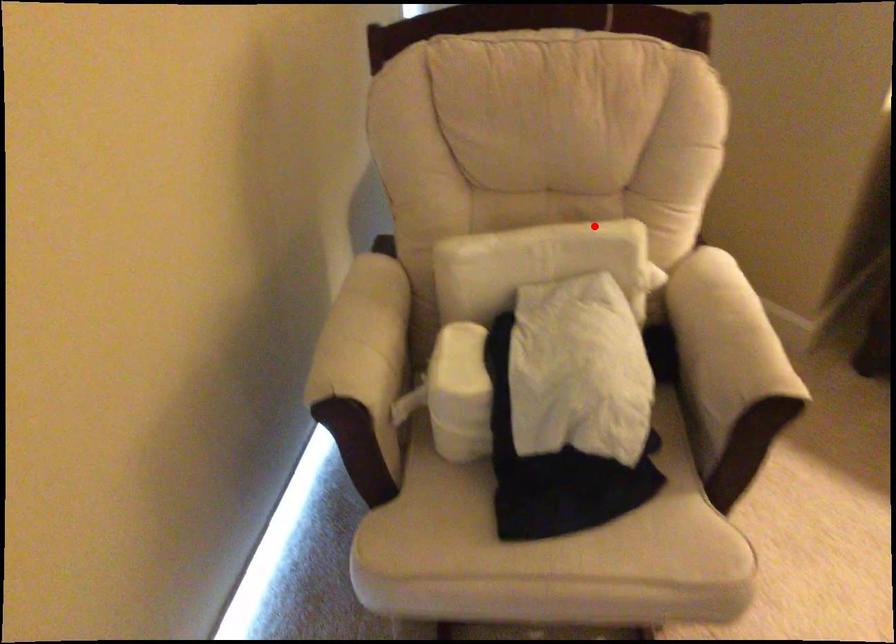
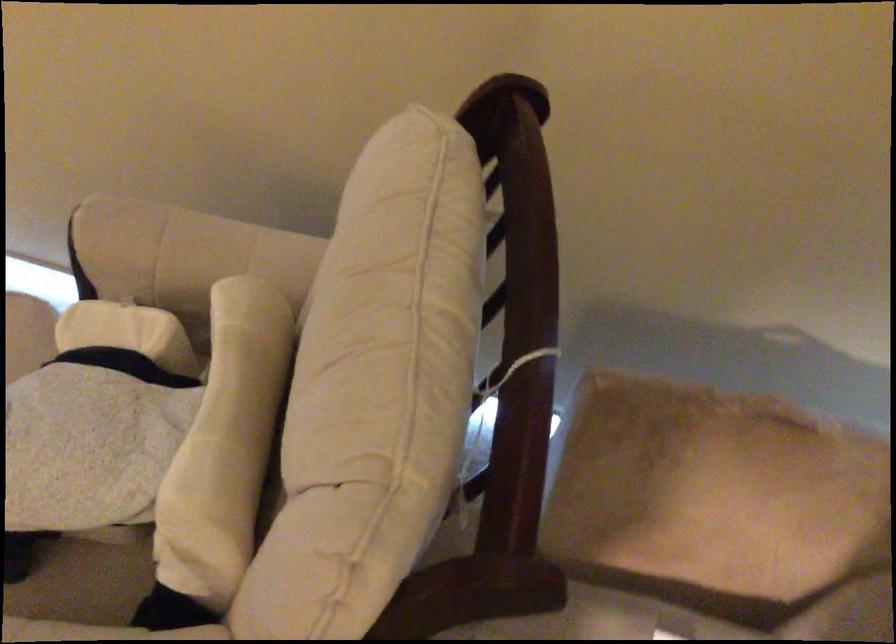
Question: I am providing you with two images of the same scene from different viewpoints. Given a red point in image1, look at the same physical point in image2. Is it:

Choices:
 (A) Closer to the viewpoint
 (B) Farther from the viewpoint

Answer: (A)